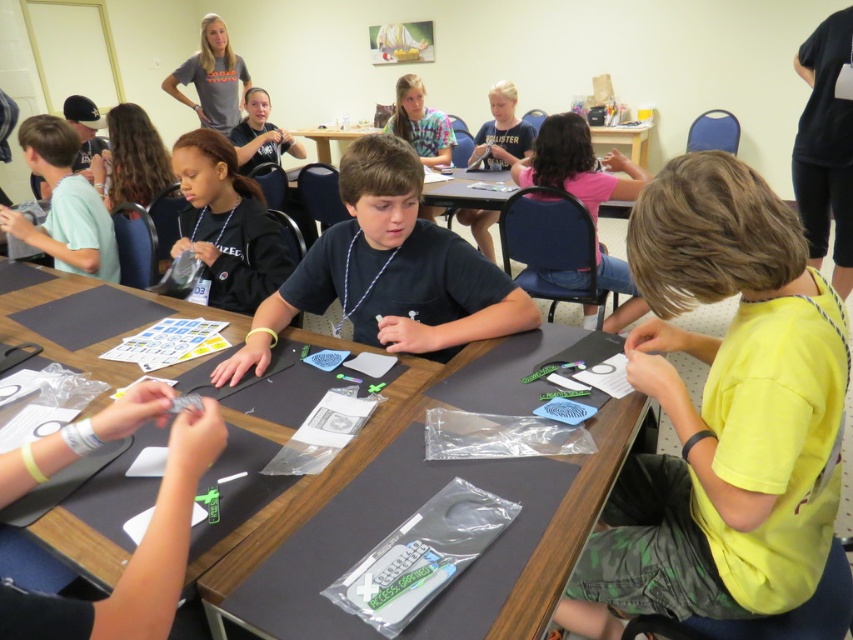
You are a photographer standing at the back of the classroom. You want to take a photo of the two points mentioned. Which point is closer to your camera, point [386,266] or point [637,298]?

Point [386,266] is closer to the camera than point [637,298].

You are standing in the classroom and see the point at coordinates (212, 77). What object is located at that point?

The gray cotton shirt at upper left is located at point (212, 77).

You are a teacher standing at the front of the classroom. You need to hand out a worksheet to the student wearing the gray cotton shirt at upper left but you are currently holding it at the matte plastic table at center. Can you reach the student without moving from your current position?

The gray cotton shirt at upper left and matte plastic table at center are 5.21 feet apart from each other. Since the distance is 5.21 feet, you cannot reach the student without moving from the matte plastic table at center.